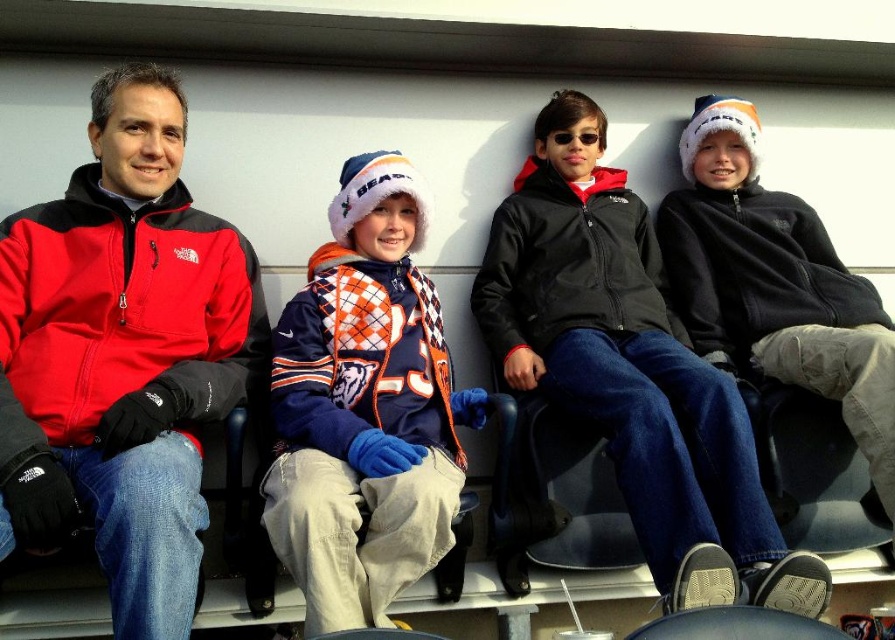
You are sitting in a stadium and see two jackets in the crowd. The matte black jacket at left and the black fleece jacket at center. Which jacket is higher up in the seating?

The matte black jacket at left is located above the black fleece jacket at center, so the matte black jacket at left is higher up in the seating.

You are sitting in the stadium and want to borrow a warm jacket from either the orange and white argyle sweater at center or the black fleece jacket at right. Which one would you choose based on size?

The black fleece jacket at right is larger than the orange and white argyle sweater at center, so you should choose the black fleece jacket at right for warmth.